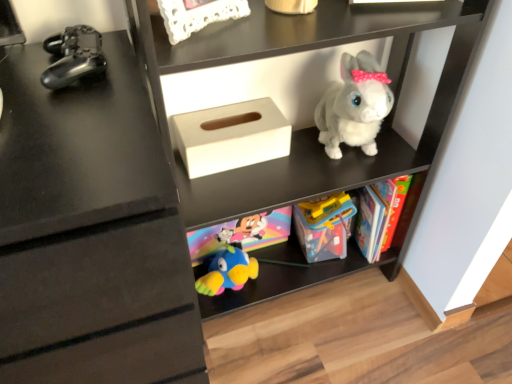
Measure the distance between point (188,185) and camera.

A distance of 38.23 inches exists between point (188,185) and camera.

From the picture: Measure the distance between translucent plastic toy at center, placed as the third toy when sorted from front to back, and camera.

The depth of translucent plastic toy at center, placed as the third toy when sorted from front to back, is 1.07 meters.

The image size is (512, 384). In order to click on fluffy white plush rabbit at upper right, which appears as the 2th toy when viewed from the front in this screenshot , I will do `click(354, 106)`.

In order to face fluffy white plush rabbit at upper right, the 1th toy in the right-to-left sequence, should I rotate leftwards or rightwards?

Turn right by 13.534 degrees to look at fluffy white plush rabbit at upper right, the 1th toy in the right-to-left sequence.

Find the location of `metallic black controller at left, which is counted as the third toy, starting from the back`. metallic black controller at left, which is counted as the third toy, starting from the back is located at coordinates (73, 56).

Is metallic black controller at left, marked as the first toy in a left-to-right arrangement, wider than white matte plush rabbit at upper center?

In fact, metallic black controller at left, marked as the first toy in a left-to-right arrangement, might be narrower than white matte plush rabbit at upper center.

From the image's perspective, which is below, metallic black controller at left, marked as the first toy in a left-to-right arrangement, or white matte plush rabbit at upper center?

white matte plush rabbit at upper center, from the image's perspective.

The image size is (512, 384). I want to click on toy that is the 2nd one when counting upward from the white matte plush rabbit at upper center (from the image's perspective), so click(x=73, y=56).

Is white matte plush rabbit at upper center at the back of metallic black controller at left, which is counted as the third toy, starting from the back?

No, white matte plush rabbit at upper center is not at the back of metallic black controller at left, which is counted as the third toy, starting from the back.

Which of these two, metallic black controller at left, marked as the first toy in a left-to-right arrangement, or fluffy white plush rabbit at upper right, marked as the second toy in a back-to-front arrangement, is smaller?

metallic black controller at left, marked as the first toy in a left-to-right arrangement, is smaller.

Is the surface of metallic black controller at left, which is the third toy from right to left, in direct contact with fluffy white plush rabbit at upper right, which is the third toy in left-to-right order?

No, metallic black controller at left, which is the third toy from right to left, is not next to fluffy white plush rabbit at upper right, which is the third toy in left-to-right order.

Is metallic black controller at left, which is the third toy from right to left, facing towards fluffy white plush rabbit at upper right, which is the third toy in left-to-right order?

No.

How many degrees apart are the facing directions of metallic black controller at left, marked as the first toy in a left-to-right arrangement, and fluffy white plush rabbit at upper right, the 1th toy in the right-to-left sequence?

They differ by 1.45 degrees in their facing directions.

Is translucent plastic toy at center, placed as the third toy when sorted from front to back, far away from white matte plush rabbit at upper center?

No.

Does point (321, 206) lie in front of point (397, 250)?

Yes, point (321, 206) is closer to viewer.

Between translucent plastic toy at center, the 2th toy positioned from the left, and white matte plush rabbit at upper center, which one has smaller size?

translucent plastic toy at center, the 2th toy positioned from the left.

Is translucent plastic toy at center, which is the 2th toy in right-to-left order, thinner than white matte plush rabbit at upper center?

Indeed, translucent plastic toy at center, which is the 2th toy in right-to-left order, has a lesser width compared to white matte plush rabbit at upper center.

Is fluffy white plush rabbit at upper right, the 1th toy in the right-to-left sequence, aimed at white matte plush rabbit at upper center?

Yes, fluffy white plush rabbit at upper right, the 1th toy in the right-to-left sequence, is turned towards white matte plush rabbit at upper center.

Which object is wider, fluffy white plush rabbit at upper right, which appears as the 2th toy when viewed from the front, or white matte plush rabbit at upper center?

white matte plush rabbit at upper center.

Consider the image. From the image's perspective, which is above, fluffy white plush rabbit at upper right, which is the third toy in left-to-right order, or white matte plush rabbit at upper center?

fluffy white plush rabbit at upper right, which is the third toy in left-to-right order.

From a real-world perspective, relative to white matte plush rabbit at upper center, is fluffy white plush rabbit at upper right, which appears as the 2th toy when viewed from the front, vertically above or below?

fluffy white plush rabbit at upper right, which appears as the 2th toy when viewed from the front, is above white matte plush rabbit at upper center.

Is white matte tissue box at center outside of white matte plush rabbit at upper center?

That's incorrect, white matte tissue box at center is not completely outside white matte plush rabbit at upper center.

Which object is wider, white matte tissue box at center or white matte plush rabbit at upper center?

With larger width is white matte plush rabbit at upper center.

Considering the sizes of objects white matte tissue box at center and white matte plush rabbit at upper center in the image provided, who is bigger, white matte tissue box at center or white matte plush rabbit at upper center?

With larger size is white matte plush rabbit at upper center.

From the image's perspective, between white matte tissue box at center and white matte plush rabbit at upper center, which one is located above?

white matte tissue box at center.

Could you tell me if white matte tissue box at center is turned towards translucent plastic toy at center, the 2th toy positioned from the left?

No, white matte tissue box at center does not turn towards translucent plastic toy at center, the 2th toy positioned from the left.

Which is more to the right, white matte tissue box at center or translucent plastic toy at center, the 2th toy positioned from the left?

From the viewer's perspective, translucent plastic toy at center, the 2th toy positioned from the left, appears more on the right side.

From the image's perspective, between white matte tissue box at center and translucent plastic toy at center, which is the 2th toy in right-to-left order, which one is located above?

white matte tissue box at center is shown above in the image.

From a real-world perspective, is white matte tissue box at center located beneath translucent plastic toy at center, which is the 2th toy in right-to-left order?

Actually, white matte tissue box at center is physically above translucent plastic toy at center, which is the 2th toy in right-to-left order, in the real world.

Consider the image. Could you tell me if translucent plastic toy at center, placed as the third toy when sorted from front to back, is facing white matte tissue box at center?

No.

Based on their sizes in the image, would you say translucent plastic toy at center, which is the 2th toy in right-to-left order, is bigger or smaller than white matte tissue box at center?

Clearly, translucent plastic toy at center, which is the 2th toy in right-to-left order, is larger in size than white matte tissue box at center.

Consider the image. Which is more distant, [316,225] or [217,151]?

The point [316,225] is farther from the camera.

Is translucent plastic toy at center, placed as the third toy when sorted from front to back, in contact with white matte tissue box at center?

They are not placed beside each other.

You are a GUI agent. You are given a task and a screenshot of the screen. Output one action in this format:
    pyautogui.click(x=<x>, y=<y>)
    Task: Click on the shelf below the metallic black controller at left, marked as the first toy in a left-to-right arrangement (from a real-world perspective)
    The height and width of the screenshot is (384, 512).
    Given the screenshot: What is the action you would take?
    pyautogui.click(x=342, y=145)

You are a GUI agent. You are given a task and a screenshot of the screen. Output one action in this format:
    pyautogui.click(x=<x>, y=<y>)
    Task: Click on the toy in front of the fluffy white plush rabbit at upper right, the 1th toy in the right-to-left sequence
    
    Given the screenshot: What is the action you would take?
    pyautogui.click(x=73, y=56)

Estimate the real-world distances between objects in this image. Which object is closer to translucent plastic toy at center, placed as the third toy when sorted from front to back, white matte plush rabbit at upper center or metallic black controller at left, which appears as the 1th toy when viewed from the front?

Among the two, white matte plush rabbit at upper center is located nearer to translucent plastic toy at center, placed as the third toy when sorted from front to back.

Estimate the real-world distances between objects in this image. Which object is further from metallic black controller at left, which appears as the 1th toy when viewed from the front, white matte tissue box at center or translucent plastic toy at center, the 2th toy positioned from the left?

translucent plastic toy at center, the 2th toy positioned from the left.

Based on their spatial positions, is white matte tissue box at center or white matte plush rabbit at upper center further from fluffy white plush rabbit at upper right, which appears as the 2th toy when viewed from the front?

white matte tissue box at center lies further to fluffy white plush rabbit at upper right, which appears as the 2th toy when viewed from the front, than the other object.

Which object lies further to the anchor point white matte tissue box at center, translucent plastic toy at center, placed as the third toy when sorted from front to back, or white matte plush rabbit at upper center?

The object further to white matte tissue box at center is translucent plastic toy at center, placed as the third toy when sorted from front to back.

Looking at the image, which one is located further to white matte plush rabbit at upper center, translucent plastic toy at center, which is the 2th toy in right-to-left order, or fluffy white plush rabbit at upper right, the 1th toy in the right-to-left sequence?

translucent plastic toy at center, which is the 2th toy in right-to-left order, is positioned further to the anchor white matte plush rabbit at upper center.

Estimate the real-world distances between objects in this image. Which object is closer to white matte tissue box at center, fluffy white plush rabbit at upper right, which appears as the 2th toy when viewed from the front, or metallic black controller at left, marked as the first toy in a left-to-right arrangement?

fluffy white plush rabbit at upper right, which appears as the 2th toy when viewed from the front, is positioned closer to the anchor white matte tissue box at center.

When comparing their distances from metallic black controller at left, marked as the first toy in a left-to-right arrangement, does translucent plastic toy at center, placed as the third toy when sorted from front to back, or fluffy white plush rabbit at upper right, which is the third toy in left-to-right order, seem further?

translucent plastic toy at center, placed as the third toy when sorted from front to back, is further to metallic black controller at left, marked as the first toy in a left-to-right arrangement.

Based on their spatial positions, is metallic black controller at left, which is counted as the third toy, starting from the back, or fluffy white plush rabbit at upper right, which appears as the 2th toy when viewed from the front, further from translucent plastic toy at center, the 2th toy positioned from the left?

metallic black controller at left, which is counted as the third toy, starting from the back, is further to translucent plastic toy at center, the 2th toy positioned from the left.

This screenshot has width=512, height=384. In order to click on toy located between white matte tissue box at center and fluffy white plush rabbit at upper right, which is the third toy in left-to-right order, in the left-right direction in this screenshot , I will do [x=324, y=226].

Locate an element on the screen. This screenshot has height=384, width=512. shelf between metallic black controller at left, marked as the first toy in a left-to-right arrangement, and translucent plastic toy at center, the 2th toy positioned from the left, in the horizontal direction is located at coordinates (342, 145).

I want to click on shoe box between metallic black controller at left, which is the third toy from right to left, and white matte plush rabbit at upper center, so click(x=231, y=136).

You are a GUI agent. You are given a task and a screenshot of the screen. Output one action in this format:
    pyautogui.click(x=<x>, y=<y>)
    Task: Click on the shoe box between white matte plush rabbit at upper center and translucent plastic toy at center, acting as the first toy starting from the back, from front to back
    The image size is (512, 384).
    Given the screenshot: What is the action you would take?
    pyautogui.click(x=231, y=136)